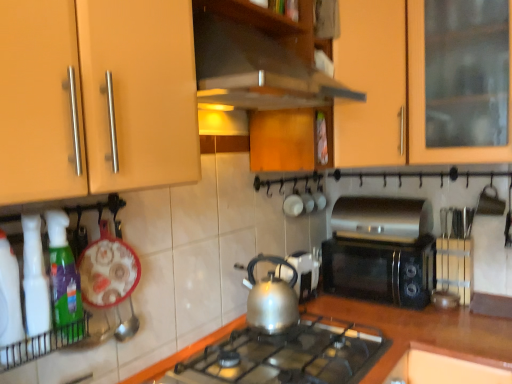
Question: From the image's perspective, is black plastic microwave at center-right, acting as the third kitchen appliance starting from the front, above or below silver metallic kettle at center, arranged as the second kitchen appliance when viewed from the front?

Choices:
 (A) above
 (B) below

Answer: (A)

Question: Do you think black plastic microwave at center-right, the 3th kitchen appliance positioned from the left, is within silver metallic kettle at center, which ranks as the 2th kitchen appliance in back-to-front order, or outside of it?

Choices:
 (A) outside
 (B) inside

Answer: (A)

Question: Based on their relative distances, which object is nearer to the metallic silver gas stove at center?

Choices:
 (A) translucent plastic spray bottle at lower left
 (B) silver metallic kettle at center, which is the 2th kitchen appliance from left to right
 (C) silver metallic kettle at center
 (D) wooden exhaust hood at upper center
 (E) black plastic microwave at center-right, the 3th kitchen appliance positioned from the left

Answer: (B)

Question: Estimate the real-world distances between objects in this image. Which object is closer to the metallic silver gas stove at center?

Choices:
 (A) silver metallic kettle at center, arranged as the second kitchen appliance when viewed from the front
 (B) matte wood cabinet at upper left, the 1th cabinetry when ordered from front to back
 (C) silver metallic kettle at center
 (D) translucent green spray bottle at left, marked as the 3th kitchen appliance in a back-to-front arrangement
 (E) wooden at center

Answer: (A)